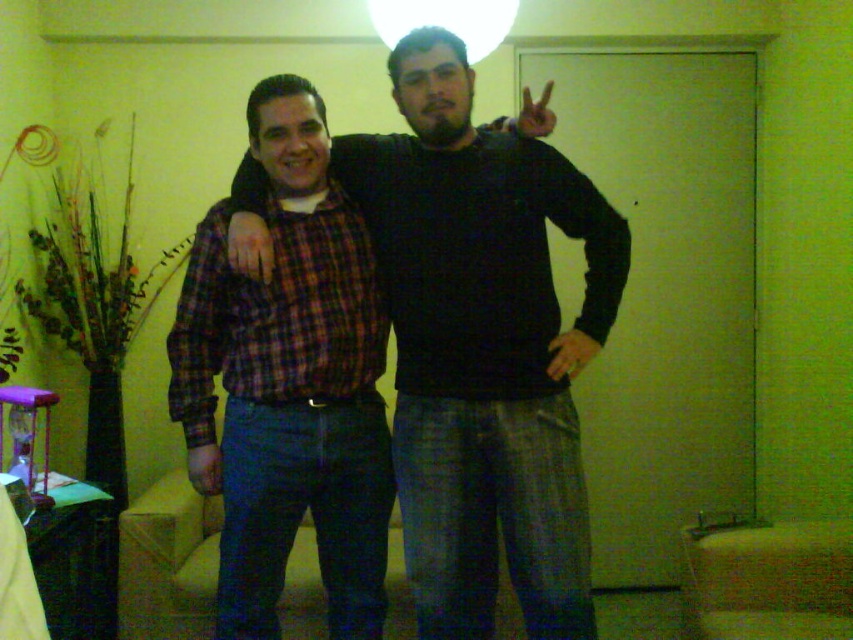
You are planning to hang a picture frame that is 1 meter tall on the light green wall between the plaid fabric shirt at center and the white matte lampshade at upper center. Is there enough vertical space between them to fit the frame?

The plaid fabric shirt at center is located below the white matte lampshade at upper center. Since the picture frame is 1 meter tall, we need to know the distance between them. However, the exact vertical distance isn not provided in the description. Therefore, it is uncertain if there is enough space to fit the frame.

You are standing in the living room and need to place a small package between the plaid fabric shirt at center and the white matte lampshade at upper center. Which object should you place the package closer to if you want it nearer to the lampshade?

The plaid fabric shirt at center is to the right of the white matte lampshade at upper center, so to place the package nearer to the lampshade, you should position it closer to the white matte lampshade at upper center.